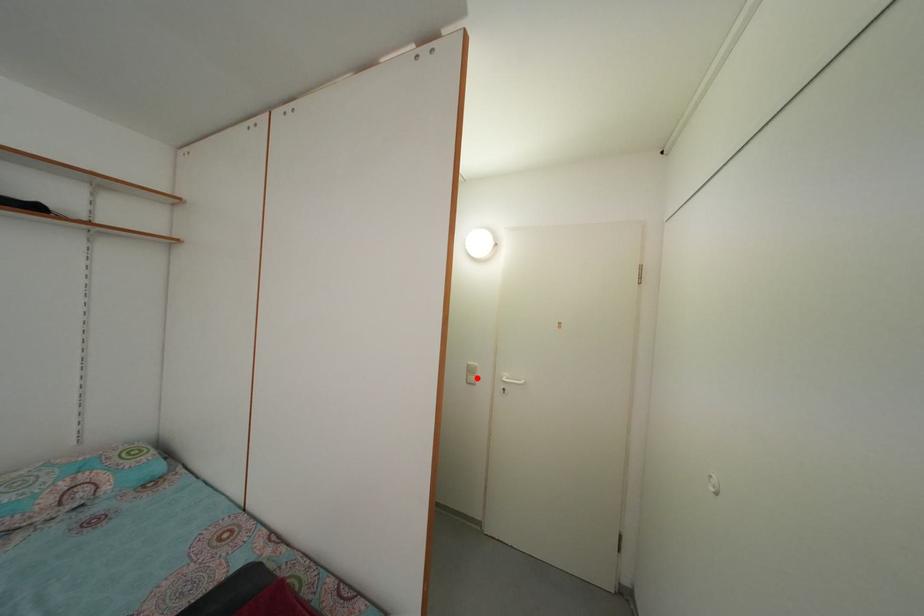
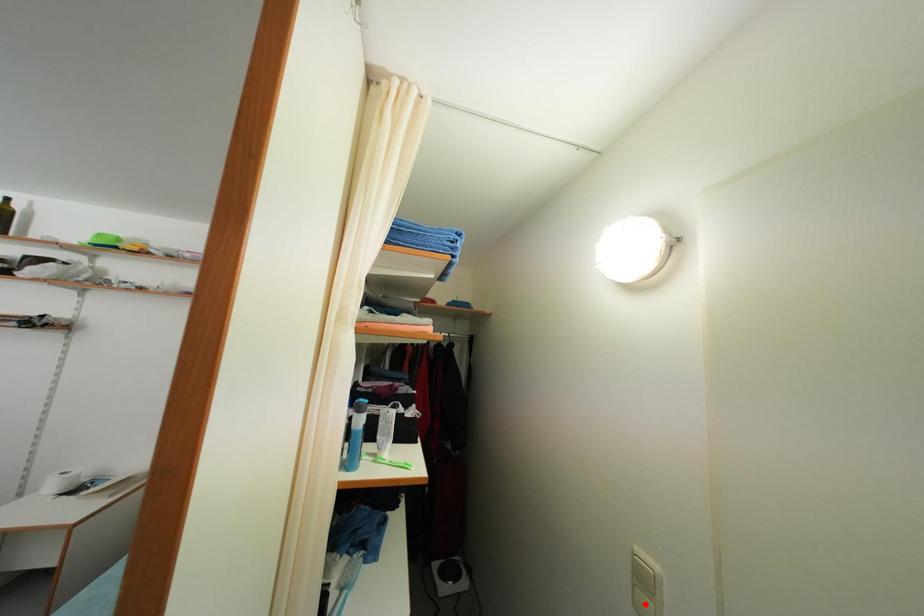
I am providing you with two images of the same scene from different viewpoints. A red point is marked on the first image and another point is marked on the second image. Is the marked point in image1 the same physical position as the marked point in image2?

No